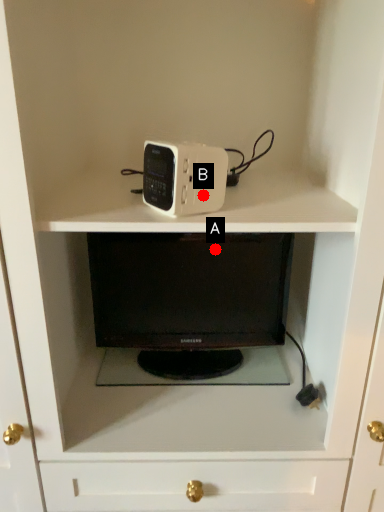
Question: Two points are circled on the image, labeled by A and B beside each circle. Which point is further to the camera?

Choices:
 (A) A is further
 (B) B is further

Answer: (A)